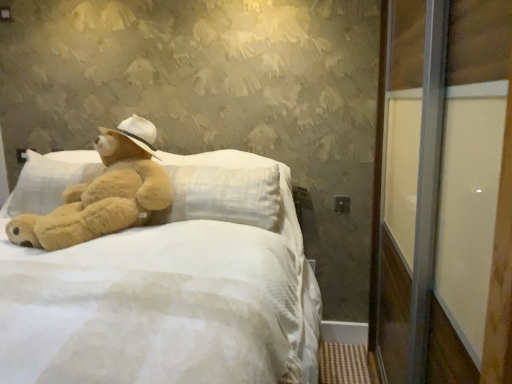
Question: Would you say transparent glass screen door at right contains soft white fabric bed at center?

Choices:
 (A) yes
 (B) no

Answer: (B)

Question: Is transparent glass screen door at right at the right side of soft white fabric bed at center?

Choices:
 (A) yes
 (B) no

Answer: (A)

Question: From the image's perspective, is transparent glass screen door at right below soft white fabric bed at center?

Choices:
 (A) yes
 (B) no

Answer: (B)

Question: Is transparent glass screen door at right shorter than soft white fabric bed at center?

Choices:
 (A) yes
 (B) no

Answer: (B)

Question: Can you confirm if transparent glass screen door at right is thinner than soft white fabric bed at center?

Choices:
 (A) no
 (B) yes

Answer: (B)

Question: Considering the relative sizes of transparent glass screen door at right and soft white fabric bed at center in the image provided, is transparent glass screen door at right bigger than soft white fabric bed at center?

Choices:
 (A) yes
 (B) no

Answer: (B)

Question: Considering the relative sizes of soft white fabric bed at center and transparent glass screen door at right in the image provided, is soft white fabric bed at center bigger than transparent glass screen door at right?

Choices:
 (A) yes
 (B) no

Answer: (A)

Question: Is soft white fabric bed at center further to the viewer compared to transparent glass screen door at right?

Choices:
 (A) yes
 (B) no

Answer: (A)

Question: Considering the relative sizes of soft white fabric bed at center and transparent glass screen door at right in the image provided, is soft white fabric bed at center wider than transparent glass screen door at right?

Choices:
 (A) no
 (B) yes

Answer: (B)

Question: Can you confirm if soft white fabric bed at center is smaller than transparent glass screen door at right?

Choices:
 (A) no
 (B) yes

Answer: (A)

Question: From a real-world perspective, is soft white fabric bed at center on transparent glass screen door at right?

Choices:
 (A) no
 (B) yes

Answer: (A)

Question: Is transparent glass screen door at right surrounded by soft white fabric bed at center?

Choices:
 (A) yes
 (B) no

Answer: (B)

Question: Is fuzzy beige teddy bear at left bigger than transparent glass screen door at right?

Choices:
 (A) no
 (B) yes

Answer: (A)